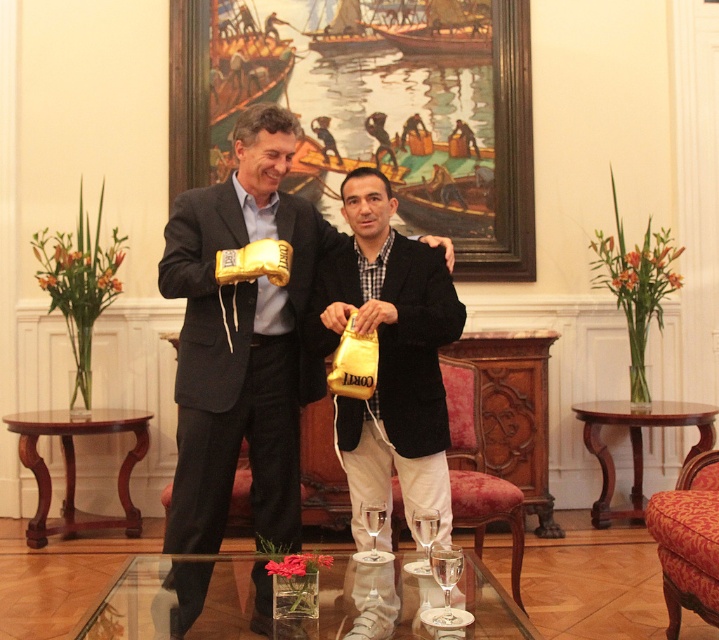
You are a photographer setting up for a closeup shot of the gold metallic boxing glove at center and the velvet upholstered armchair at center. The camera requires a minimum distance of 30 inches between the two objects to frame them properly. Based on the scene description, will you need to adjust their positions?

The gold metallic boxing glove at center and the velvet upholstered armchair at center are 29.45 inches apart, which is less than the required 30 inches. Therefore, you will need to adjust their positions to meet the camera framing requirements.

You are a photographer standing at the camera position. You want to take a closeup photo of the gold metallic boxing gloves at center. How many steps do you need to take forward to get the gloves to fill the frame? Assume each step is 0.75 meters.

The gold metallic boxing gloves at center is 2.71 meters from camera. To fill the frame, you need to move closer. Since each step is 0.75 meters, dividing 2.71 by 0.75 gives approximately 3.61 steps. Since you can only take whole steps, you would need to take 4 steps forward to get close enough.